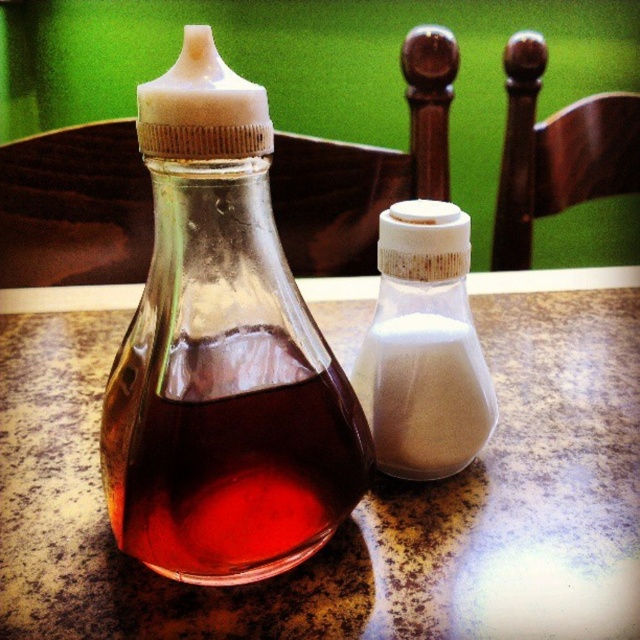
You are a delivery person who needs to place a small package on the countertop between the two points, point A at point (273, 374) and point B at point (474, 419). According to the image, which point is closer to the front edge of the countertop?

Point A at point (273, 374) is closer to the front edge of the countertop because it is in front of point B at point (474, 419).

You are setting up a dining table and need to place both the brown marble table at center and the white matte salt shaker at center. Since both are at the center, which one will you place first to ensure proper positioning?

The brown marble table at center is bigger than the white matte salt shaker at center, so you should place the brown marble table at center first to ensure there is enough space for the smaller salt shaker.

You are arranging items on a kitchen counter and need to place a brown marble table at center and a transparent glass bottle at center. According to the image, which object should be placed to the left side?

The transparent glass bottle at center should be placed to the left side because the brown marble table at center is to its right as per the description.